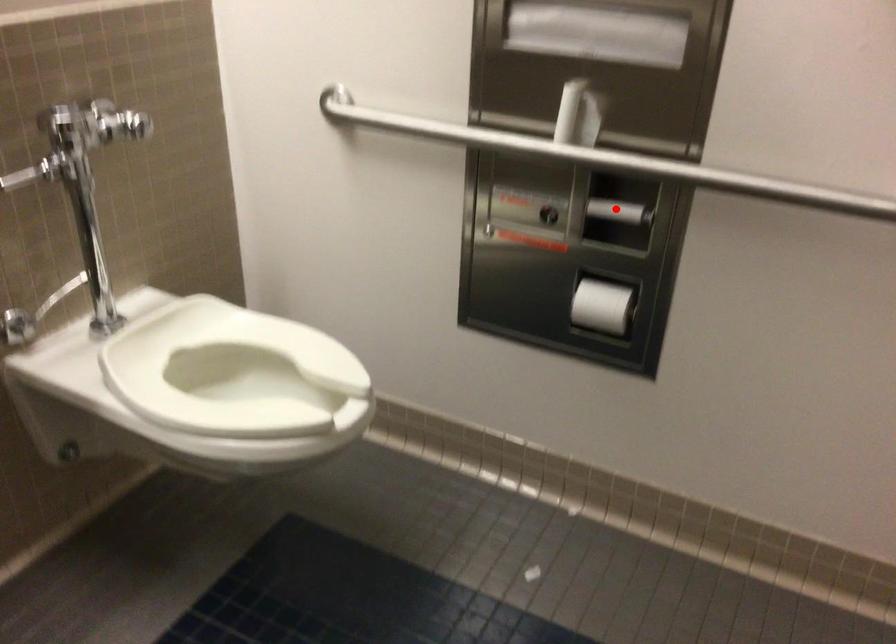
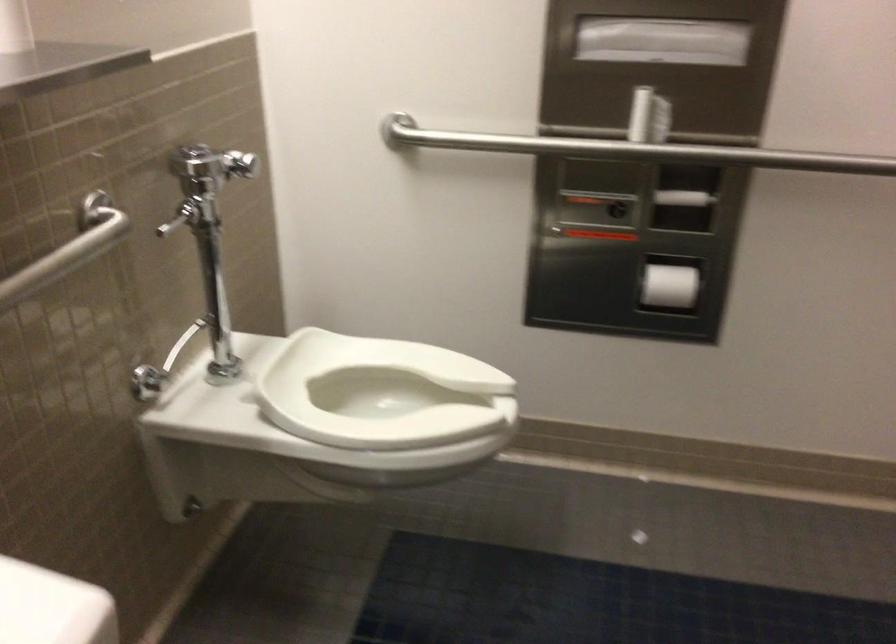
Question: A red point is marked in image1. In image2, is the corresponding 3D point closer to the camera or farther? Reply with the corresponding letter.

Choices:
 (A) The corresponding 3D point is closer.
 (B) The corresponding 3D point is farther.

Answer: (B)